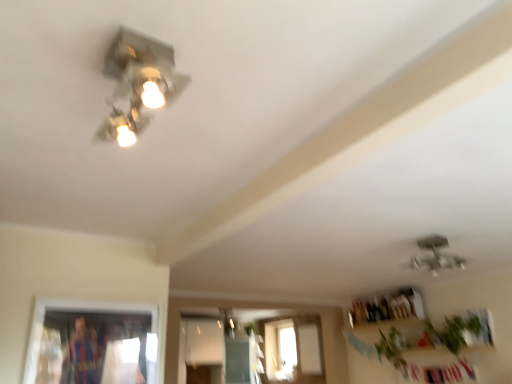
Question: Is metallic silver light fixture at upper left, placed as the first lamp when sorted from front to back, inside matte silver lamp at center, marked as the 3th lamp in a top-to-bottom arrangement?

Choices:
 (A) no
 (B) yes

Answer: (A)

Question: Are matte silver lamp at center, the third lamp positioned from the front, and metallic silver light fixture at upper left, the second lamp positioned from the left, beside each other?

Choices:
 (A) yes
 (B) no

Answer: (B)

Question: Is matte silver lamp at center, arranged as the first lamp when viewed from the left, wider than metallic silver light fixture at upper left, the second lamp positioned from the left?

Choices:
 (A) no
 (B) yes

Answer: (A)

Question: Would you consider matte silver lamp at center, arranged as the first lamp when viewed from the left, to be distant from metallic silver light fixture at upper left, the third lamp positioned from the bottom?

Choices:
 (A) yes
 (B) no

Answer: (A)

Question: From a real-world perspective, is matte silver lamp at center, the third lamp positioned from the front, positioned under metallic silver light fixture at upper left, the second lamp positioned from the left, based on gravity?

Choices:
 (A) no
 (B) yes

Answer: (B)

Question: Would you say green leafy plant at lower right, placed as the first plant when sorted from right to left, is to the left or to the right of metallic silver light fixture at upper left, the third lamp when ordered from back to front, in the picture?

Choices:
 (A) left
 (B) right

Answer: (B)

Question: Does point (459, 319) appear closer or farther from the camera than point (111, 124)?

Choices:
 (A) closer
 (B) farther

Answer: (B)

Question: Would you say green leafy plant at lower right, which is the second plant in left-to-right order, is inside or outside metallic silver light fixture at upper left, the third lamp when ordered from back to front?

Choices:
 (A) outside
 (B) inside

Answer: (A)

Question: In terms of height, does green leafy plant at lower right, acting as the 2th plant starting from the back, look taller or shorter compared to metallic silver light fixture at upper left, acting as the 1th lamp starting from the top?

Choices:
 (A) tall
 (B) short

Answer: (A)

Question: Based on their sizes in the image, would you say green leafy plant at lower right, acting as the first plant starting from the front, is bigger or smaller than metallic silver light fixture at upper center, arranged as the 2th lamp when viewed from the back?

Choices:
 (A) big
 (B) small

Answer: (A)

Question: Is green leafy plant at lower right, which is the second plant in left-to-right order, wider or thinner than metallic silver light fixture at upper center, arranged as the 2th lamp when viewed from the back?

Choices:
 (A) wide
 (B) thin

Answer: (B)

Question: From the image's perspective, is green leafy plant at lower right, acting as the first plant starting from the front, positioned above or below metallic silver light fixture at upper center, positioned as the first lamp in right-to-left order?

Choices:
 (A) above
 (B) below

Answer: (B)

Question: Would you say green leafy plant at lower right, placed as the first plant when sorted from right to left, is inside or outside metallic silver light fixture at upper center, the second lamp viewed from the front?

Choices:
 (A) outside
 (B) inside

Answer: (A)

Question: Is point (440, 266) closer or farther from the camera than point (473, 314)?

Choices:
 (A) farther
 (B) closer

Answer: (B)

Question: From a real-world perspective, is metallic silver light fixture at upper center, the 2th lamp when ordered from top to bottom, above or below green leafy plant at lower right, which is the second plant in left-to-right order?

Choices:
 (A) below
 (B) above

Answer: (B)